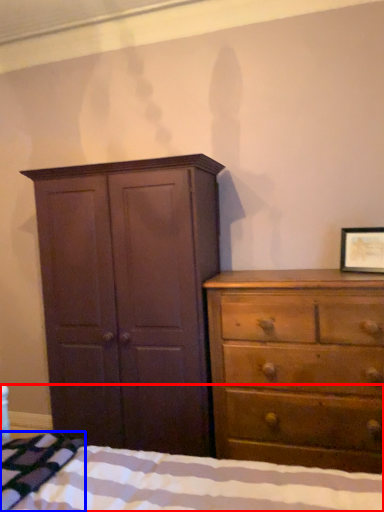
Question: Which of the following is the closest to the observer, bed (highlighted by a red box) or blanket (highlighted by a blue box)?

Choices:
 (A) bed
 (B) blanket

Answer: (A)